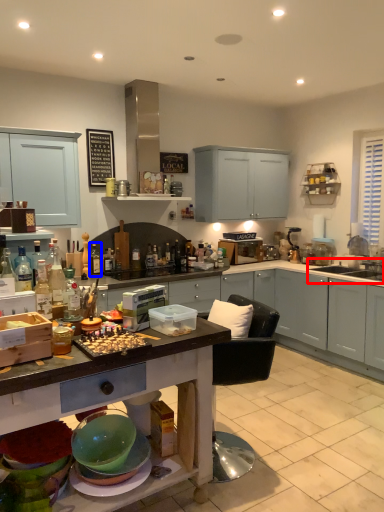
Question: Which object is further to the camera taking this photo, sink (highlighted by a red box) or bottle (highlighted by a blue box)?

Choices:
 (A) sink
 (B) bottle

Answer: (A)